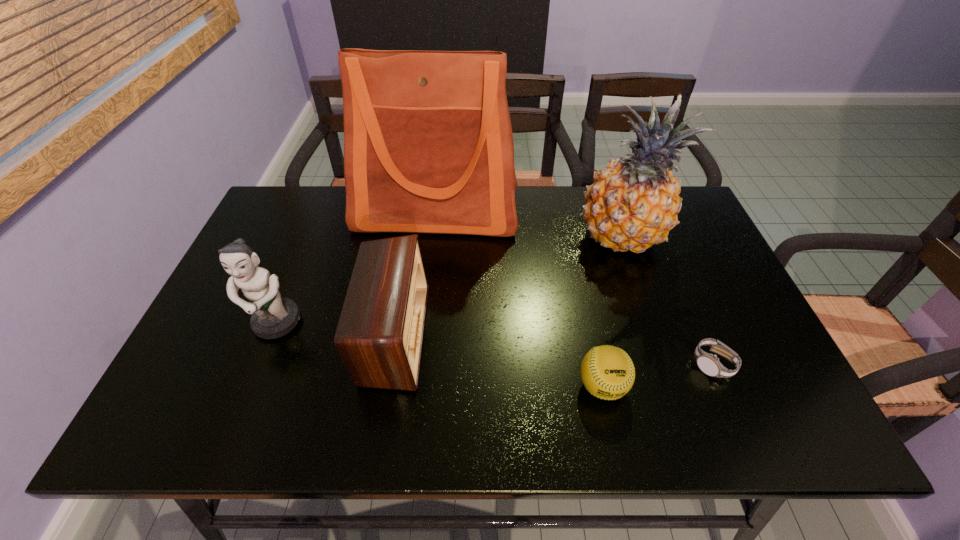
The height and width of the screenshot is (540, 960). What are the coordinates of `vacant space at the far edge of the desktop` in the screenshot? It's located at (359, 232).

This screenshot has width=960, height=540. I want to click on vacant region at the near edge of the desktop, so click(x=322, y=439).

Identify the location of vacant space at the left edge of the desktop. The image size is (960, 540). (203, 386).

Find the location of a particular element. Image resolution: width=960 pixels, height=540 pixels. vacant space at the right edge of the desktop is located at coordinates (661, 246).

What are the coordinates of `vacant space at the far left corner of the desktop` in the screenshot? It's located at (279, 193).

Where is `free space at the near right corner of the desktop`? The width and height of the screenshot is (960, 540). free space at the near right corner of the desktop is located at coordinates (732, 408).

This screenshot has height=540, width=960. Identify the location of empty location between the pineapple and the shopping bag. (528, 226).

What are the coordinates of `free space that is in between the softball and the pineapple` in the screenshot? It's located at (612, 312).

Where is `vacant area that lies between the pineapple and the shopping bag`? The height and width of the screenshot is (540, 960). vacant area that lies between the pineapple and the shopping bag is located at coordinates (528, 226).

Where is `free spot between the shopping bag and the pineapple`? free spot between the shopping bag and the pineapple is located at coordinates (528, 226).